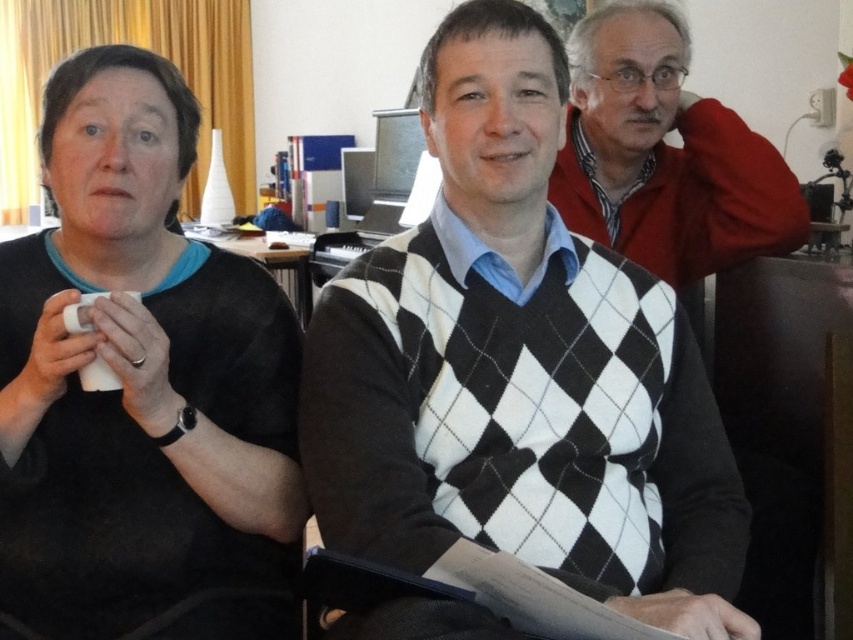
Does black and white argyle sweater at center come behind matte red sweater at upper right?

No, it is in front of matte red sweater at upper right.

Can you confirm if black and white argyle sweater at center is positioned below matte red sweater at upper right?

Yes.

Between point (483, 316) and point (677, 180), which one is positioned in front?

Positioned in front is point (483, 316).

Locate an element on the screen. The width and height of the screenshot is (853, 640). black and white argyle sweater at center is located at coordinates (518, 369).

Is point (508, 435) closer to camera compared to point (236, 321)?

Yes, it is.

Who is positioned more to the right, black and white argyle sweater at center or black matte sweater at left?

black and white argyle sweater at center

Find the location of `black and white argyle sweater at center`. black and white argyle sweater at center is located at coordinates (518, 369).

Between black matte sweater at left and matte red sweater at upper right, which one is positioned higher?

matte red sweater at upper right is above.

Between black matte sweater at left and matte red sweater at upper right, which one has more height?

With more height is black matte sweater at left.

Who is more forward, (x=44, y=628) or (x=738, y=160)?

Point (x=44, y=628) is more forward.

The width and height of the screenshot is (853, 640). I want to click on black matte sweater at left, so click(x=141, y=387).